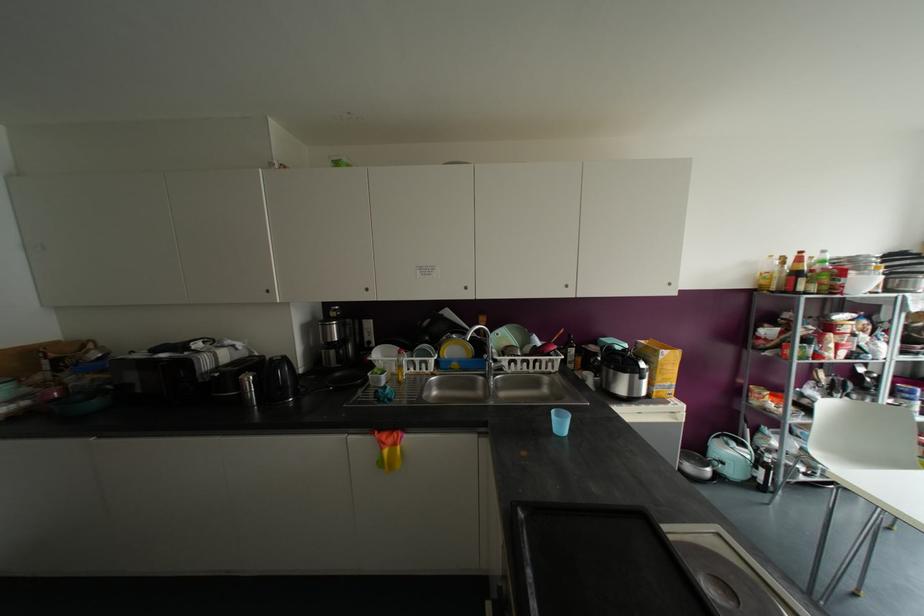
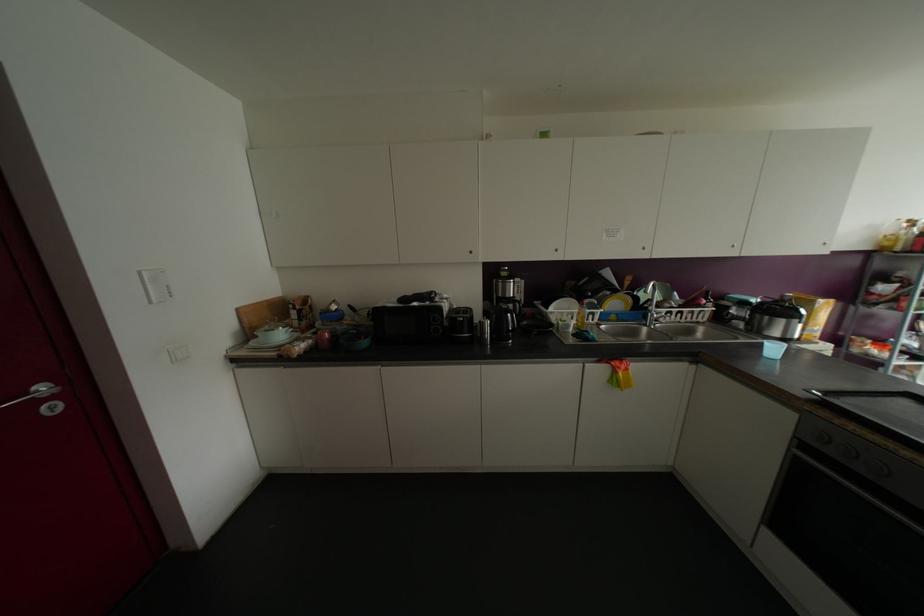
Locate, in the second image, the point that corresponds to (94,403) in the first image.

(363, 342)